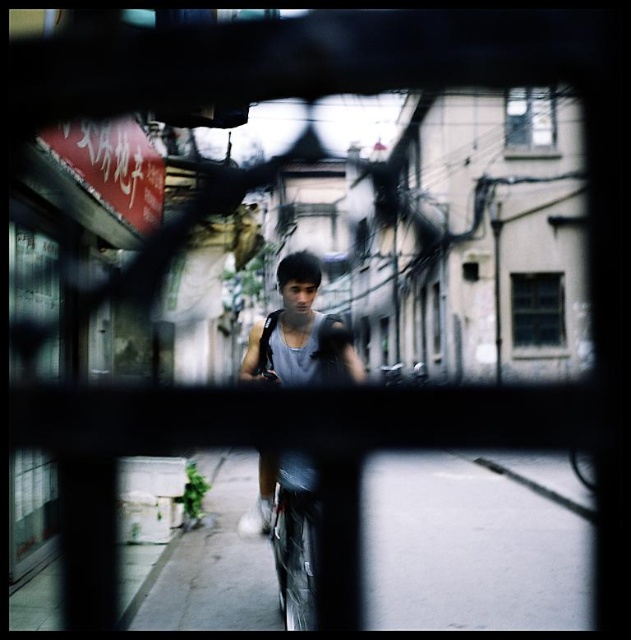
Can you confirm if gray concrete pavement at lower center is positioned to the right of gray matte tank top at center?

Indeed, gray concrete pavement at lower center is positioned on the right side of gray matte tank top at center.

Which is behind, point (251, 579) or point (240, 522)?

Positioned behind is point (251, 579).

Where is `gray concrete pavement at lower center`? This screenshot has width=631, height=640. gray concrete pavement at lower center is located at coordinates (475, 544).